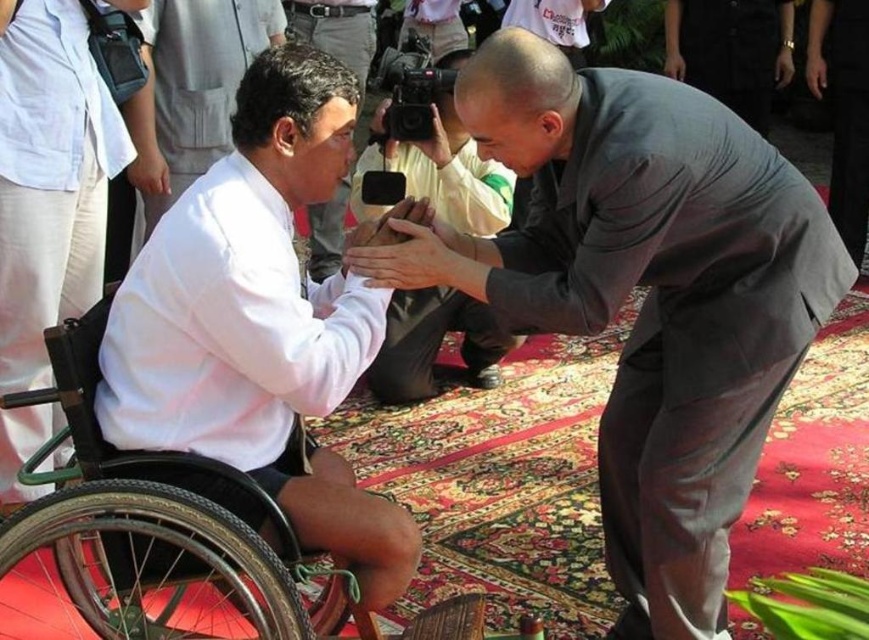
Question: Is gray suit at center below smooth beige handbag at center?

Choices:
 (A) yes
 (B) no

Answer: (A)

Question: Can you confirm if gray suit at center is bigger than white matte shirt at left?

Choices:
 (A) no
 (B) yes

Answer: (B)

Question: Which of the following is the farthest from the observer?

Choices:
 (A) (456, 157)
 (B) (174, 480)
 (C) (795, 353)
 (D) (306, 285)

Answer: (A)

Question: Is gray suit at center smaller than white matte shirt at left?

Choices:
 (A) no
 (B) yes

Answer: (A)

Question: Which point is closer to the camera?

Choices:
 (A) (680, 301)
 (B) (44, 394)

Answer: (B)

Question: Which is farther from the smooth beige handbag at center?

Choices:
 (A) gray suit at center
 (B) white matte shirt at left
 (C) black rubber wheelchair at left

Answer: (C)